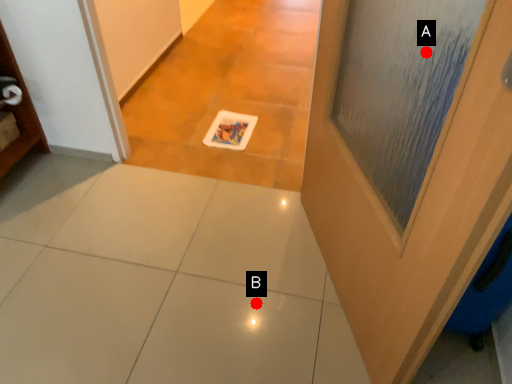
Question: Two points are circled on the image, labeled by A and B beside each circle. Which of the following is the farthest from the observer?

Choices:
 (A) A is further
 (B) B is further

Answer: (B)